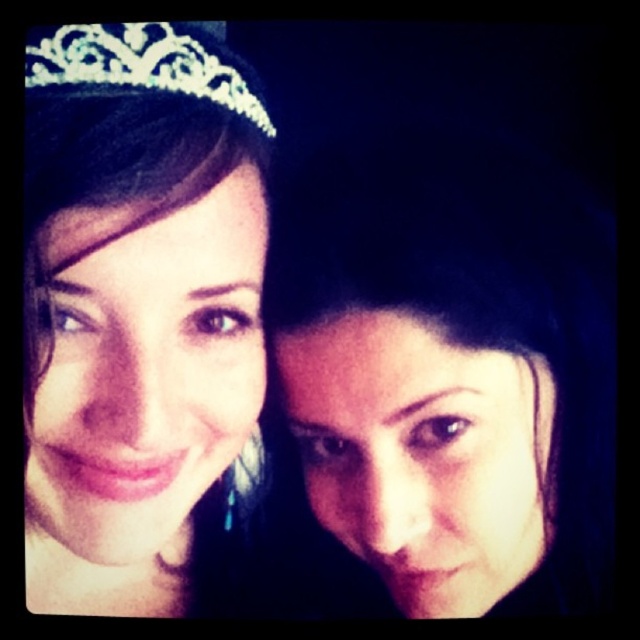
Question: From the image, what is the correct spatial relationship of matte silver tiara at upper left in relation to clear crystal tiara at upper left?

Choices:
 (A) right
 (B) left

Answer: (B)

Question: Can you confirm if smooth skin face at right is positioned to the left of clear crystal tiara at upper left?

Choices:
 (A) no
 (B) yes

Answer: (A)

Question: Can you confirm if smooth skin face at right is positioned below matte silver tiara at upper left?

Choices:
 (A) yes
 (B) no

Answer: (A)

Question: Which object appears closest to the camera in this image?

Choices:
 (A) smooth skin face at right
 (B) matte silver tiara at upper left
 (C) clear crystal tiara at upper left

Answer: (B)

Question: Which point is closer to the camera?

Choices:
 (A) (458, 280)
 (B) (147, 547)

Answer: (A)

Question: Which point is closer to the camera taking this photo?

Choices:
 (A) 195,228
 (B) 36,76

Answer: (A)